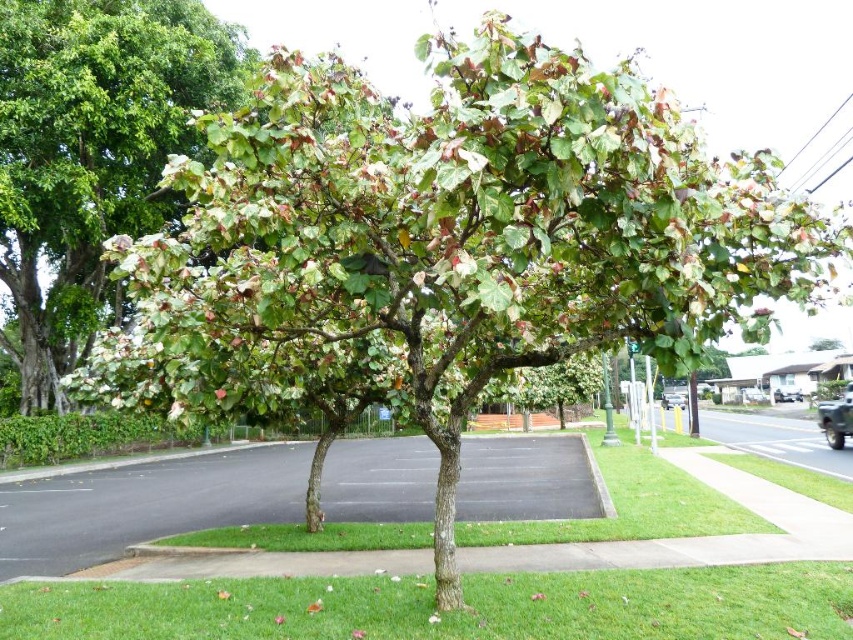
Does point (107, 67) come in front of point (36, 588)?

No, (107, 67) is behind (36, 588).

In the scene shown: Between green leafy tree at center and green grass at center, which one is positioned lower?

green grass at center is lower down.

Is point (32, 248) positioned before point (738, 595)?

That is False.

I want to click on green leafy tree at center, so click(91, 154).